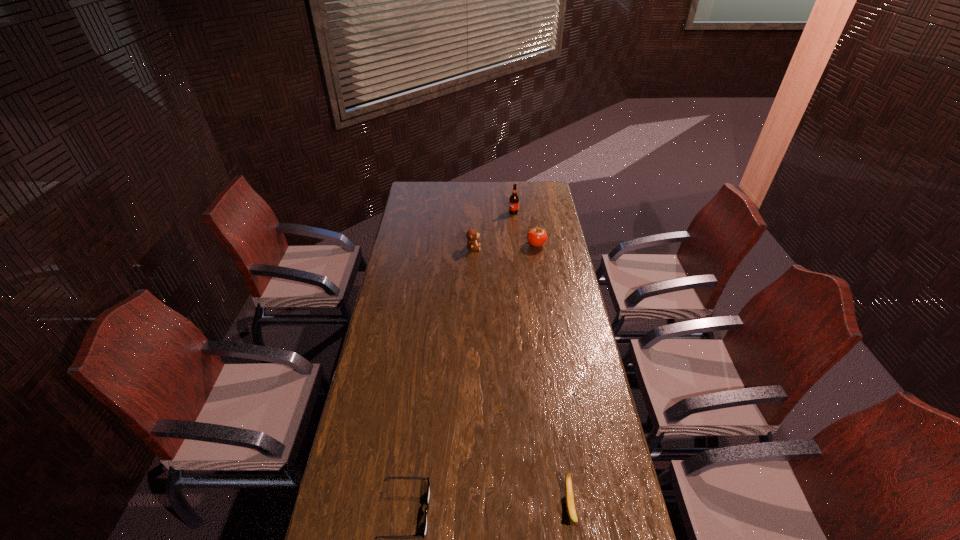
The image size is (960, 540). I want to click on the farthest object, so click(514, 199).

Where is `the third object from left to right`? the third object from left to right is located at coordinates (514, 199).

You are a GUI agent. You are given a task and a screenshot of the screen. Output one action in this format:
    pyautogui.click(x=<x>, y=<y>)
    Task: Click on the fourth object from right to left
    This screenshot has height=540, width=960.
    Given the screenshot: What is the action you would take?
    pyautogui.click(x=472, y=235)

Find the location of a particular element. This screenshot has height=540, width=960. tomato is located at coordinates (537, 237).

At what (x,y) coordinates should I click in order to perform the action: click on banana. Please return your answer as a coordinate pair (x, y). The width and height of the screenshot is (960, 540). Looking at the image, I should click on (570, 504).

I want to click on blank space located on the left of the farthest object, so click(x=491, y=212).

Locate an element on the screen. free space located on the face of the second object from left to right is located at coordinates (507, 248).

I want to click on blank area located on the back of the tomato, so click(x=533, y=225).

The height and width of the screenshot is (540, 960). I want to click on tomato present at the right edge, so click(x=537, y=237).

Identify the location of banana at the right edge. The height and width of the screenshot is (540, 960). (570, 504).